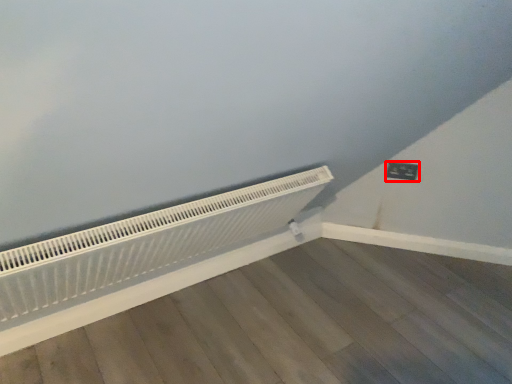
Question: Considering the relative positions of electric outlet (annotated by the red box) and heater in the image provided, where is electric outlet (annotated by the red box) located with respect to the staircase?

Choices:
 (A) left
 (B) right

Answer: (B)